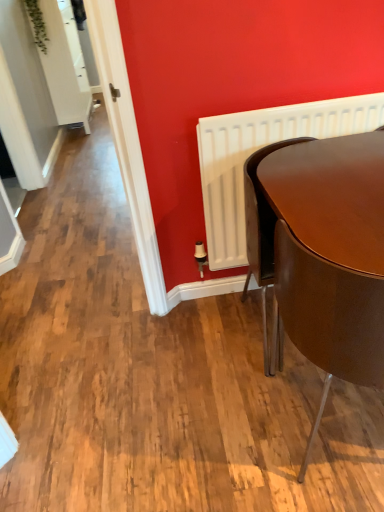
Find the location of a particular element. The height and width of the screenshot is (512, 384). free point to the left of matte brown chair at right is located at coordinates (236, 429).